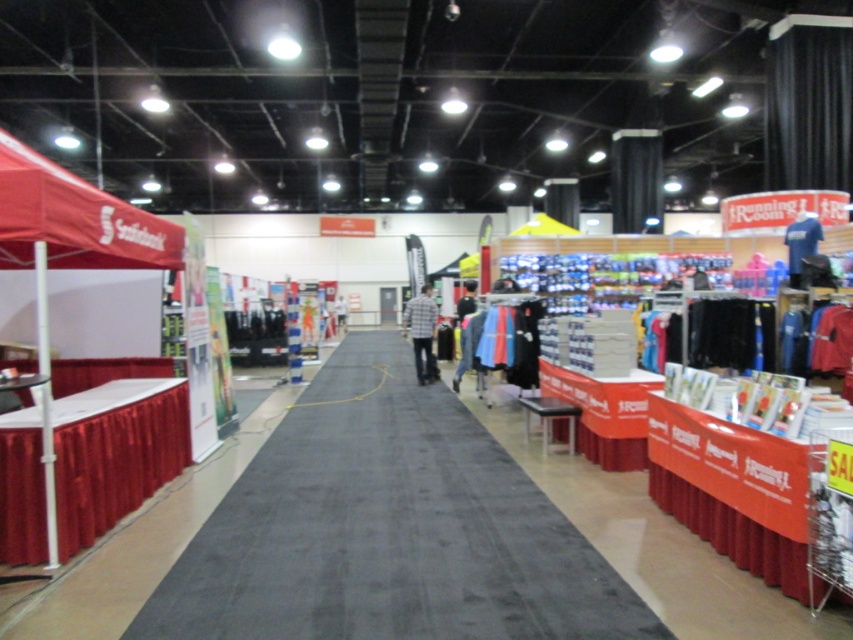
Can you confirm if black carpet at center is wider than red fabric canopy at upper left?

Yes, black carpet at center is wider than red fabric canopy at upper left.

Does black carpet at center come behind red fabric canopy at upper left?

No, it is in front of red fabric canopy at upper left.

This screenshot has width=853, height=640. Find the location of `black carpet at center`. black carpet at center is located at coordinates (387, 529).

Is red fabric canopy at upper left positioned at the back of dark blue fabric shirt at center?

No, red fabric canopy at upper left is closer to the viewer.

Does point (19, 198) come closer to viewer compared to point (457, 381)?

Yes, point (19, 198) is closer to viewer.

At what (x,y) coordinates should I click in order to perform the action: click on red fabric canopy at upper left. Please return your answer as a coordinate pair (x, y). The width and height of the screenshot is (853, 640). Looking at the image, I should click on (74, 220).

At what (x,y) coordinates should I click in order to perform the action: click on red fabric canopy at upper left. Please return your answer as a coordinate pair (x, y). The image size is (853, 640). Looking at the image, I should click on [x=74, y=220].

Who is more forward, [99,209] or [798,243]?

Point [99,209] is more forward.

Can you confirm if red fabric canopy at upper left is positioned to the right of blue jersey at center?

In fact, red fabric canopy at upper left is to the left of blue jersey at center.

Who is more distant from viewer, (27, 264) or (811, 248)?

The point (811, 248) is behind.

Find the location of a particular element. red fabric canopy at upper left is located at coordinates (74, 220).